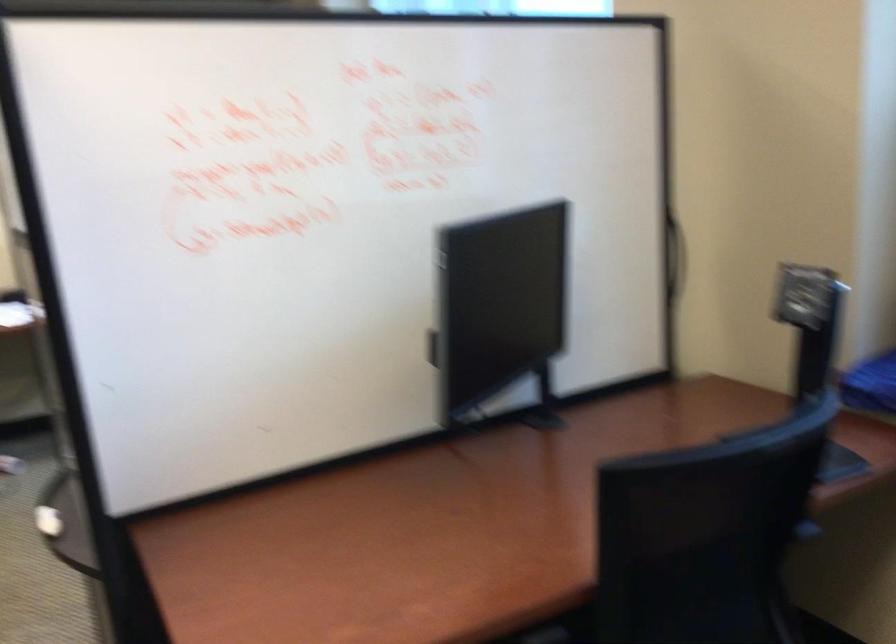
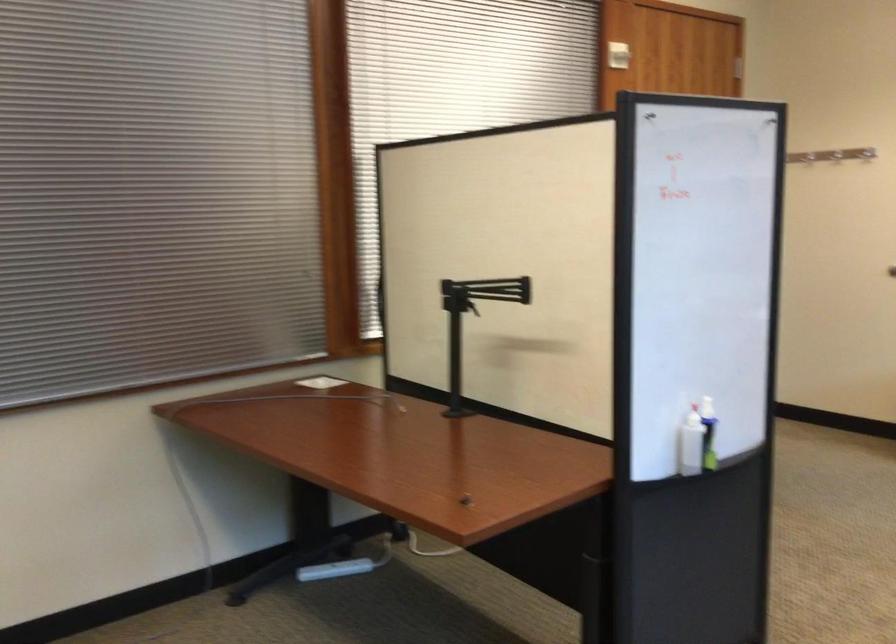
Question: The camera is either moving clockwise (left) or counter-clockwise (right) around the object. The first image is from the beginning of the video and the second image is from the end. Is the camera moving left or right when shooting the video?

Choices:
 (A) Left
 (B) Right

Answer: (B)